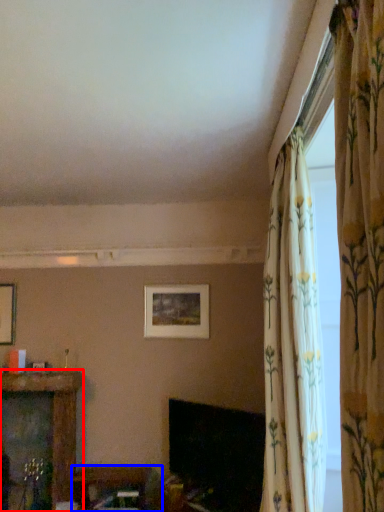
Question: Which object appears farthest to the camera in this image, furniture (highlighted by a red box) or furniture (highlighted by a blue box)?

Choices:
 (A) furniture
 (B) furniture

Answer: (A)